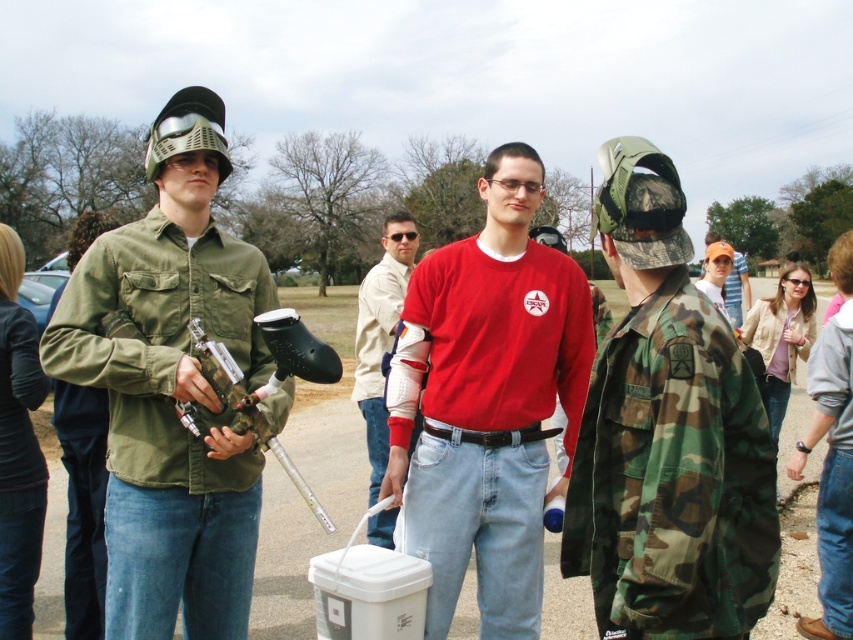
Question: Which object is positioned closest to the matte green shirt at center?

Choices:
 (A) camouflage jacket at center
 (B) red matte shirt at center

Answer: (B)

Question: Which object is positioned closest to the red matte shirt at center?

Choices:
 (A) camo fabric jacket at center
 (B) camouflage jacket at center
 (C) matte green shirt at center

Answer: (C)

Question: Is camo fabric jacket at center to the right of white textured arm guard at center from the viewer's perspective?

Choices:
 (A) no
 (B) yes

Answer: (B)

Question: Does red matte shirt at center have a smaller size compared to white textured arm guard at center?

Choices:
 (A) no
 (B) yes

Answer: (B)

Question: Which object is the closest to the camouflage jacket at center?

Choices:
 (A) red matte shirt at center
 (B) matte green shirt at center

Answer: (A)

Question: Can you confirm if matte green shirt at center is positioned to the right of red matte shirt at center?

Choices:
 (A) yes
 (B) no

Answer: (B)